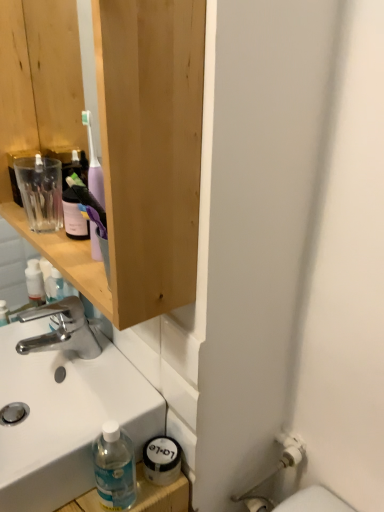
Identify the location of free space in front of polished chrome faucet at center. (91, 395).